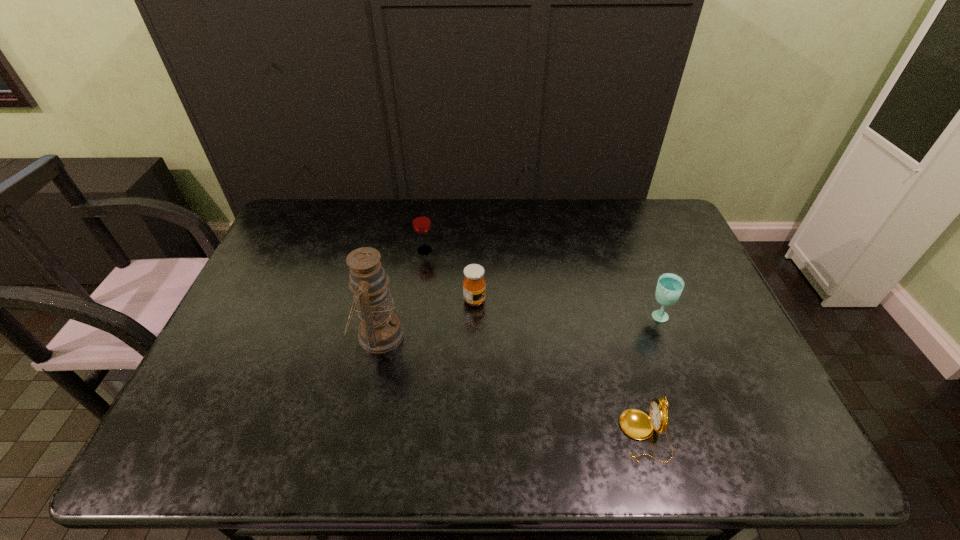
Where is `the tallest object`? the tallest object is located at coordinates (380, 331).

Identify the location of the farthest object. This screenshot has width=960, height=540. (421, 221).

Locate an element on the screen. the left glass is located at coordinates (421, 221).

The image size is (960, 540). I want to click on the nearer glass, so click(x=669, y=287).

The image size is (960, 540). I want to click on the right glass, so click(x=669, y=287).

The width and height of the screenshot is (960, 540). I want to click on the third object from left to right, so click(474, 285).

Find the location of a particular element. the fourth object from left to right is located at coordinates (638, 425).

Where is `pocket watch`? This screenshot has width=960, height=540. pocket watch is located at coordinates tap(638, 425).

You are a GUI agent. You are given a task and a screenshot of the screen. Output one action in this format:
    pyautogui.click(x=<x>, y=<y>)
    Task: Click on the free space located on the right of the oil lamp
    The width and height of the screenshot is (960, 540).
    Given the screenshot: What is the action you would take?
    pyautogui.click(x=534, y=335)

Where is `blank space located 0.280m on the left of the farthest object`? blank space located 0.280m on the left of the farthest object is located at coordinates (330, 250).